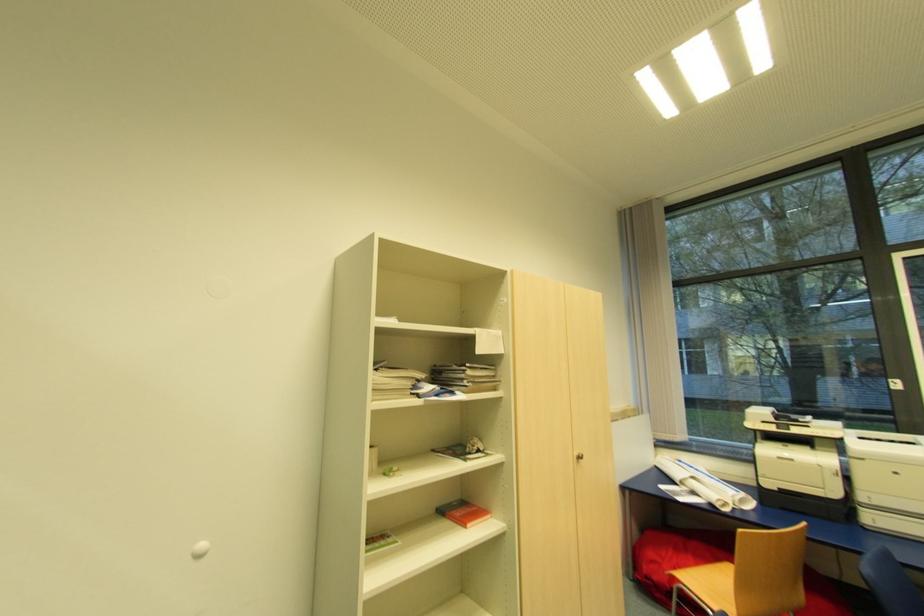
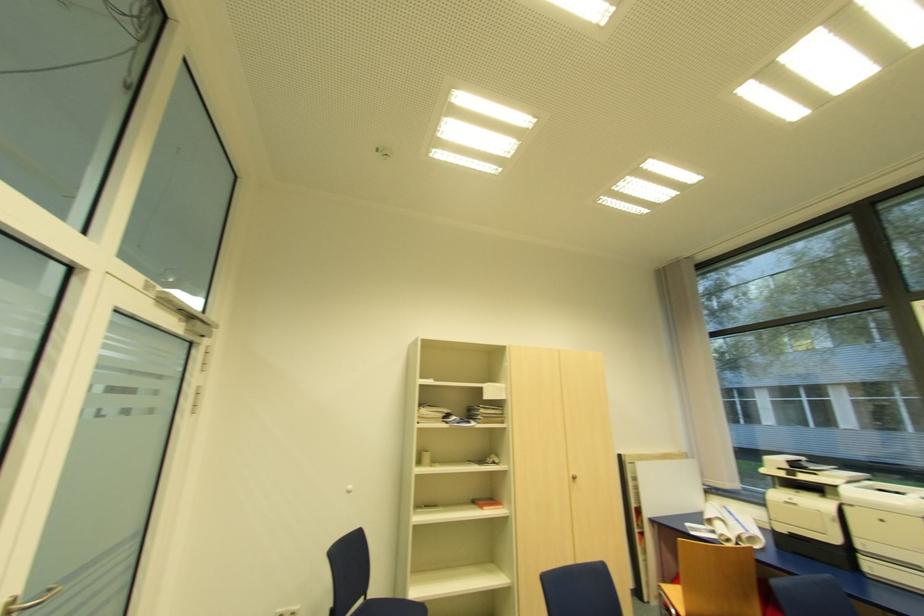
Where in the second image is the point corresponding to (x=679, y=581) from the first image?

(663, 589)